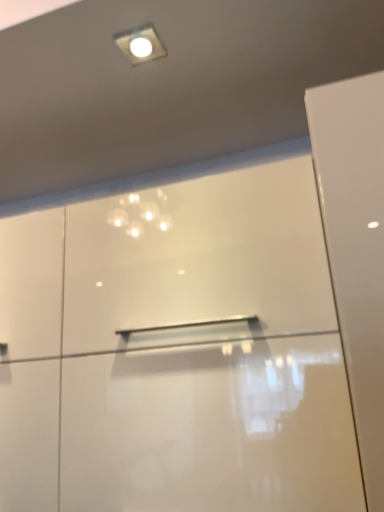
Question: Does glossy white dresser at center contain white glossy droplight at upper center?

Choices:
 (A) yes
 (B) no

Answer: (B)

Question: From the image's perspective, does glossy white dresser at center appear higher than white glossy droplight at upper center?

Choices:
 (A) yes
 (B) no

Answer: (B)

Question: Is glossy white dresser at center outside white glossy droplight at upper center?

Choices:
 (A) no
 (B) yes

Answer: (B)

Question: Is glossy white dresser at center shorter than white glossy droplight at upper center?

Choices:
 (A) yes
 (B) no

Answer: (B)

Question: Does glossy white dresser at center have a lesser width compared to white glossy droplight at upper center?

Choices:
 (A) yes
 (B) no

Answer: (B)

Question: Can you confirm if glossy white dresser at center is taller than white glossy droplight at upper center?

Choices:
 (A) no
 (B) yes

Answer: (B)

Question: Considering the relative sizes of white glossy droplight at upper center and glossy white dresser at center in the image provided, is white glossy droplight at upper center bigger than glossy white dresser at center?

Choices:
 (A) no
 (B) yes

Answer: (A)

Question: Is white glossy droplight at upper center behind glossy white dresser at center?

Choices:
 (A) yes
 (B) no

Answer: (A)

Question: Considering the relative sizes of white glossy droplight at upper center and glossy white dresser at center in the image provided, is white glossy droplight at upper center smaller than glossy white dresser at center?

Choices:
 (A) yes
 (B) no

Answer: (A)

Question: Does white glossy droplight at upper center come in front of glossy white dresser at center?

Choices:
 (A) no
 (B) yes

Answer: (A)

Question: Does white glossy droplight at upper center have a lesser width compared to glossy white dresser at center?

Choices:
 (A) yes
 (B) no

Answer: (A)

Question: Is white glossy droplight at upper center looking in the opposite direction of glossy white dresser at center?

Choices:
 (A) no
 (B) yes

Answer: (A)

Question: Which is correct: white glossy droplight at upper center is inside glossy white dresser at center, or outside of it?

Choices:
 (A) inside
 (B) outside

Answer: (B)